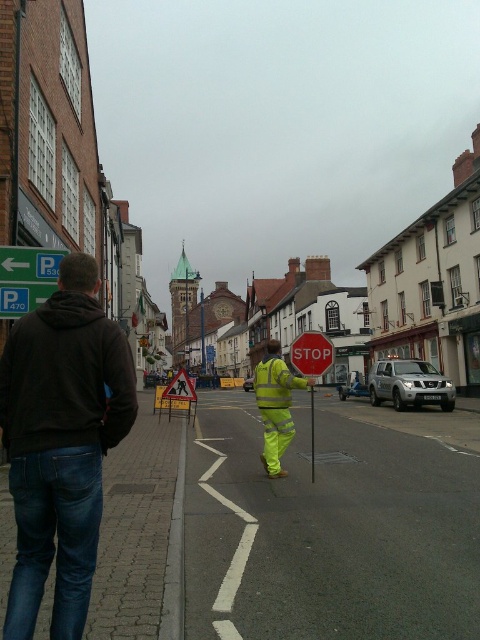
From the picture: Measure the distance between high visibility yellow-green safety vest at center and green plastic parking sign at upper left.

A distance of 3.55 meters exists between high visibility yellow-green safety vest at center and green plastic parking sign at upper left.

Based on the photo, is high visibility yellow-green safety vest at center below green plastic parking sign at upper left?

Correct, high visibility yellow-green safety vest at center is located below green plastic parking sign at upper left.

Who is more distant from viewer, (264, 385) or (38, 300)?

The point (38, 300) is more distant.

The image size is (480, 640). I want to click on high visibility yellow-green safety vest at center, so click(x=273, y=384).

Is high-visibility yellow jacket at center positioned in front of green plastic parking sign at upper left?

Yes.

Consider the image. Does high-visibility yellow jacket at center have a lesser height compared to green plastic parking sign at upper left?

Incorrect, high-visibility yellow jacket at center's height does not fall short of green plastic parking sign at upper left's.

What do you see at coordinates (276, 404) in the screenshot? Image resolution: width=480 pixels, height=640 pixels. I see `high-visibility yellow jacket at center` at bounding box center [276, 404].

Locate an element on the screen. Image resolution: width=480 pixels, height=640 pixels. high-visibility yellow jacket at center is located at coordinates (276, 404).

Is high-visibility yellow jacket at center smaller than high visibility yellow-green safety vest at center?

Incorrect, high-visibility yellow jacket at center is not smaller in size than high visibility yellow-green safety vest at center.

Based on the photo, can you confirm if high-visibility yellow jacket at center is wider than high visibility yellow-green safety vest at center?

Indeed, high-visibility yellow jacket at center has a greater width compared to high visibility yellow-green safety vest at center.

Where is `high-visibility yellow jacket at center`? The height and width of the screenshot is (640, 480). high-visibility yellow jacket at center is located at coordinates (276, 404).